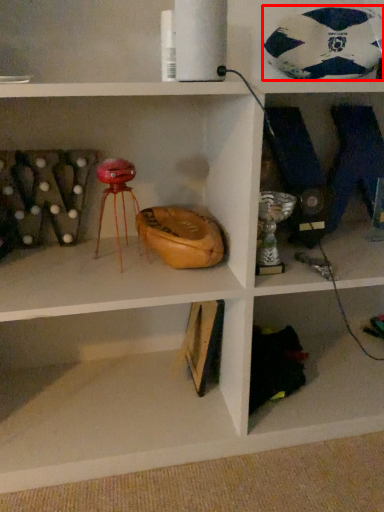
Question: From the image's perspective, what is the correct spatial relationship of football (annotated by the red box) in relation to shelf?

Choices:
 (A) below
 (B) above

Answer: (B)